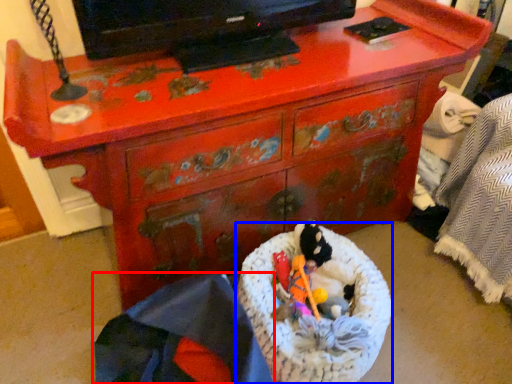
Question: Which point is closer to the camera, material (highlighted by a red box) or laundry basket (highlighted by a blue box)?

Choices:
 (A) material
 (B) laundry basket

Answer: (A)